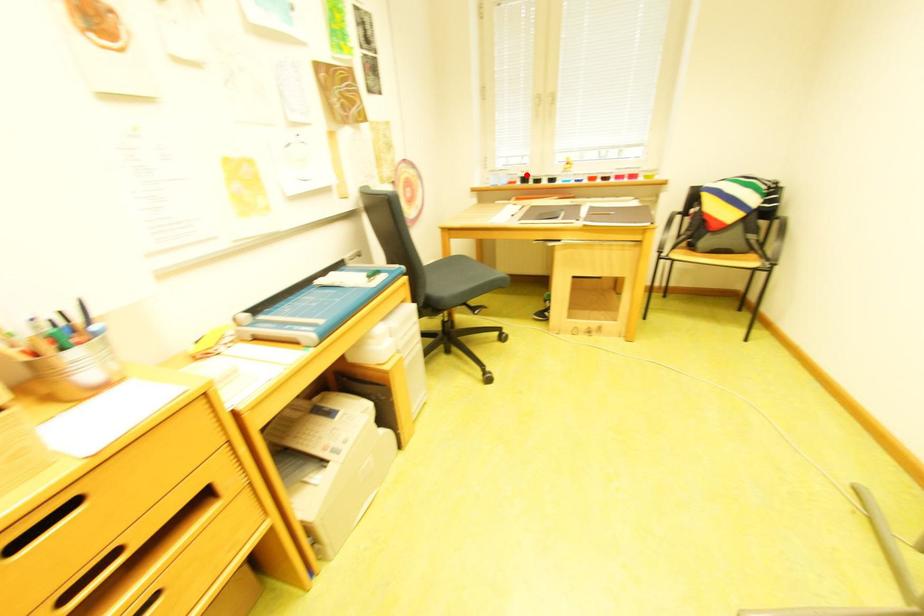
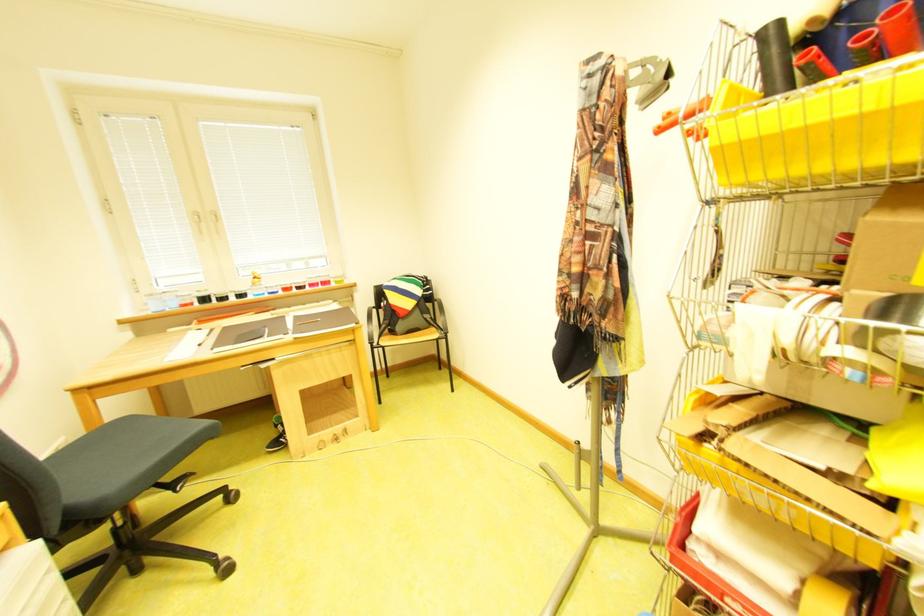
Where in the second image is the point corresponding to the highlighted location from the first image?

(201, 296)